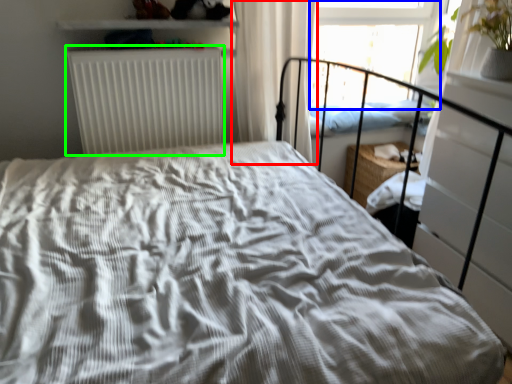
Question: Which object is the farthest from curtain (highlighted by a red box)? Choose among these: window screen (highlighted by a blue box) or radiator (highlighted by a green box).

Choices:
 (A) window screen
 (B) radiator

Answer: (A)